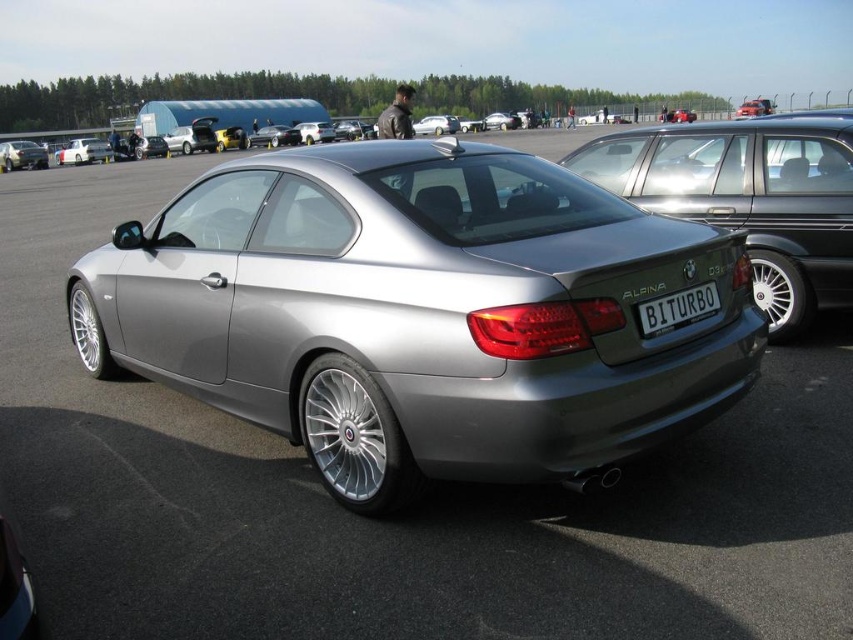
Looking at this image, you are a photographer planning to capture both the matte silver car at left and the silver metallic sedan at center in a single frame. Given their sizes, which car should you position closer to the camera to ensure both appear roughly the same size in the photo?

To make both cars appear roughly the same size in the photo, position the matte silver car at left farther from the camera than the silver metallic sedan at center. Since the matte silver car at left is larger, placing it farther away will balance their apparent sizes in the frame.

You are a photographer planning to take a photo of both the satin silver metallic car at center and the matte silver car at left. You want to ensure that both cars are in focus in the same frame. Given that your camera can only maintain sharp focus on objects within a 40 meter distance range, will you be able to capture both cars clearly in focus?

The satin silver metallic car at center and the matte silver car at left are 44.35 meters apart. Since the distance between them exceeds the camera focus range of 40 meters, it will be difficult to keep both cars in focus simultaneously in the same frame.

You are standing at the entrance of the parking lot and see the satin silver metallic car at center. If you walk straight towards the car, will you reach it before reaching the parking lot exit located at point 0.9, 0.9?

The satin silver metallic car at center is located at point (749, 196), which is closer to your starting position at the entrance than the exit at (767, 576). Therefore, you will reach the car before the exit.